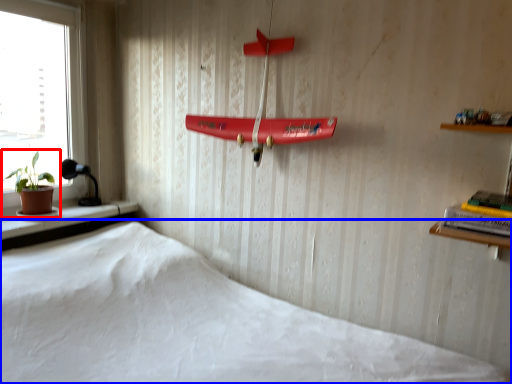
Question: Which of the following is the closest to the observer, houseplant (highlighted by a red box) or bed (highlighted by a blue box)?

Choices:
 (A) houseplant
 (B) bed

Answer: (B)